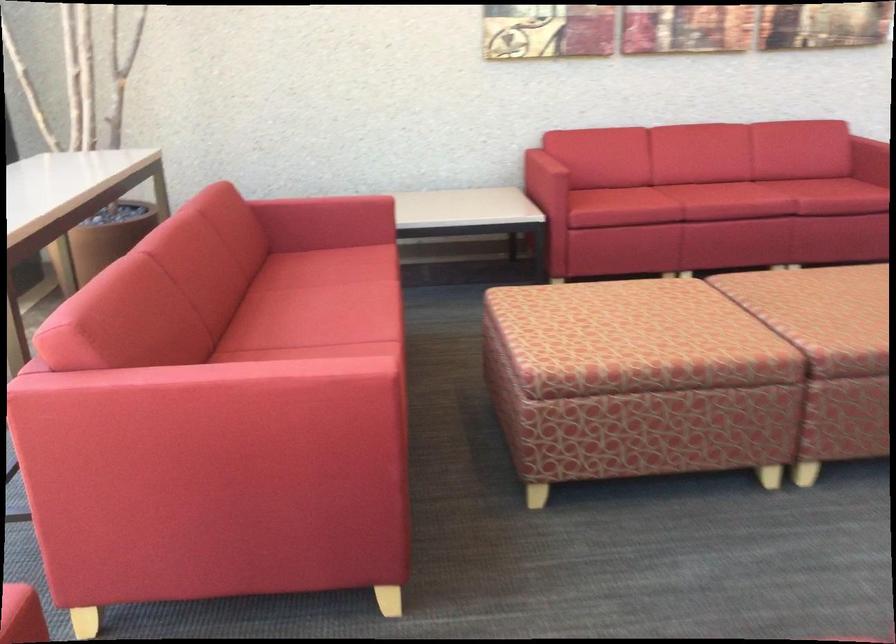
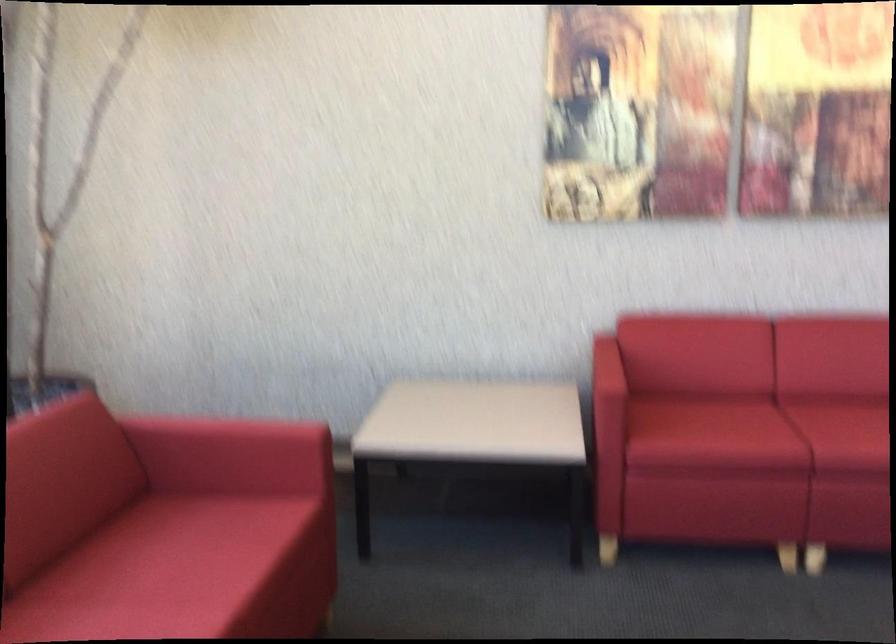
Where in the second image is the point corresponding to the point at 644,194 from the first image?

(757, 431)